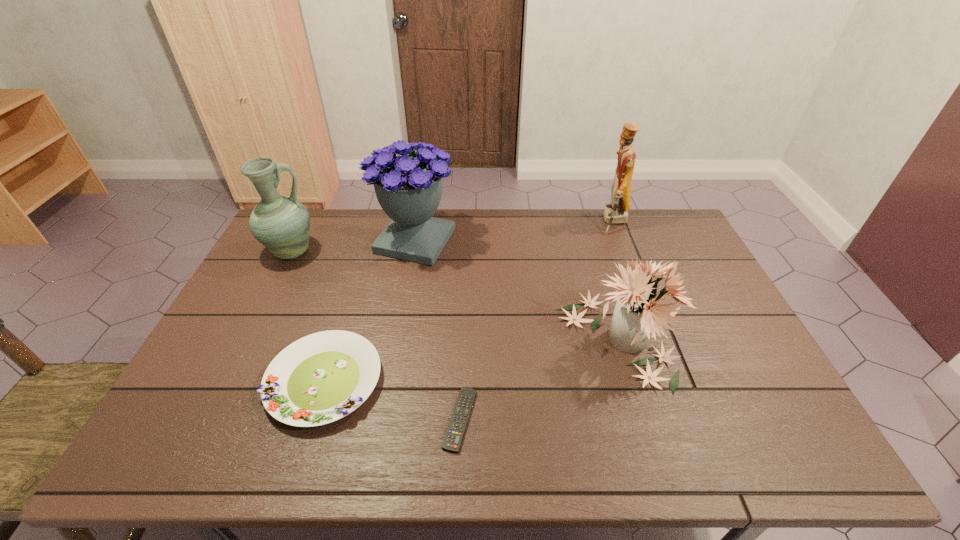
Where is `vacant space in between the salad plate and the shorter bouquet`? vacant space in between the salad plate and the shorter bouquet is located at coordinates (470, 360).

The image size is (960, 540). In order to click on free space between the third shortest object and the shortest object in this screenshot , I will do click(x=539, y=379).

Locate an element on the screen. This screenshot has width=960, height=540. vacant area that lies between the taller bouquet and the leftmost object is located at coordinates (352, 247).

The width and height of the screenshot is (960, 540). What are the coordinates of `free spot between the shortest object and the fourth tallest object` in the screenshot? It's located at pyautogui.click(x=539, y=379).

At what (x,y) coordinates should I click in order to perform the action: click on empty space that is in between the leftmost object and the fourth tallest object. Please return your answer as a coordinate pair (x, y). Looking at the image, I should click on tap(454, 296).

Image resolution: width=960 pixels, height=540 pixels. Find the location of `free space between the fifth tallest object and the pitcher`. free space between the fifth tallest object and the pitcher is located at coordinates coord(308,316).

At what (x,y) coordinates should I click in order to perform the action: click on blank region between the leftmost object and the remote control. Please return your answer as a coordinate pair (x, y). Image resolution: width=960 pixels, height=540 pixels. Looking at the image, I should click on (375, 336).

Image resolution: width=960 pixels, height=540 pixels. I want to click on unoccupied position between the pitcher and the farther bouquet, so click(x=352, y=247).

I want to click on vacant area between the remote control and the third shortest object, so click(539, 379).

What are the coordinates of `the closest object relative to the nearer bouquet` in the screenshot? It's located at (452, 442).